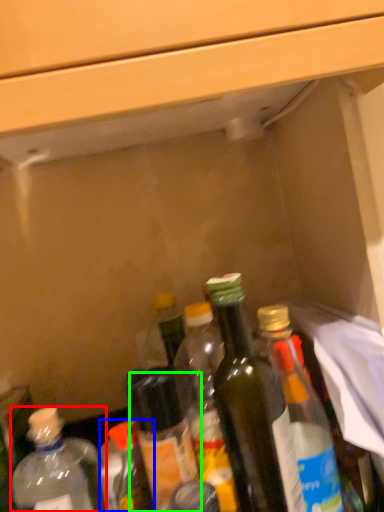
Question: Which object is the farthest from bottle (highlighted by a red box)? Choose among these: bottle (highlighted by a blue box) or bottle (highlighted by a green box).

Choices:
 (A) bottle
 (B) bottle

Answer: (B)